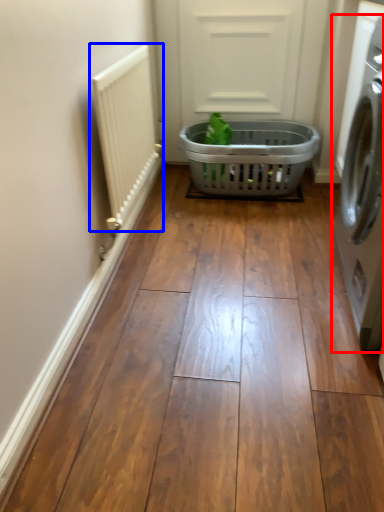
Question: Which of the following is the closest to the observer, washing machine (highlighted by a red box) or radiator (highlighted by a blue box)?

Choices:
 (A) washing machine
 (B) radiator

Answer: (A)